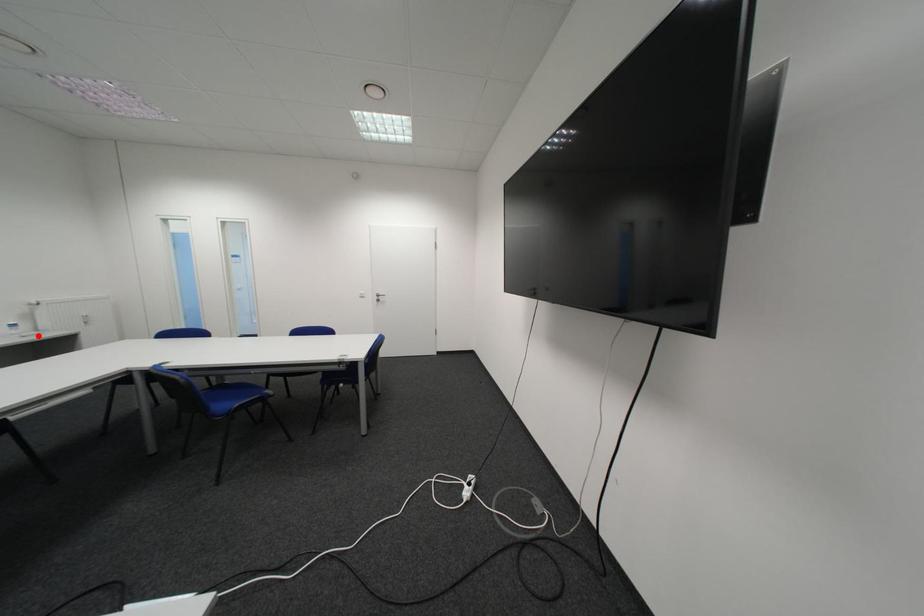
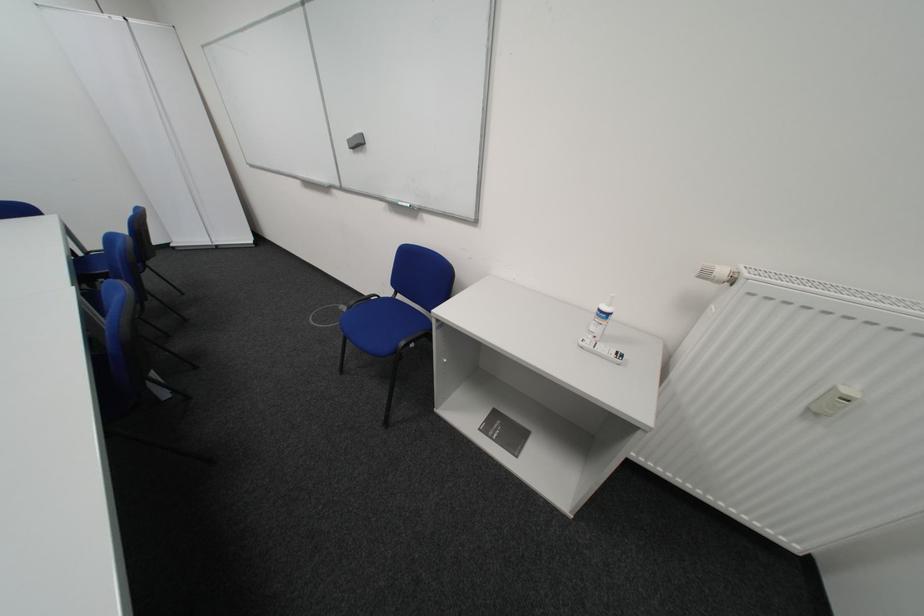
Question: I am providing you with two images of the same scene from different viewpoints. Image1 has a red point marked. In image2, the corresponding 3D location appears at what relative position? Reply with the corresponding letter.

Choices:
 (A) Closer
 (B) Farther

Answer: (A)